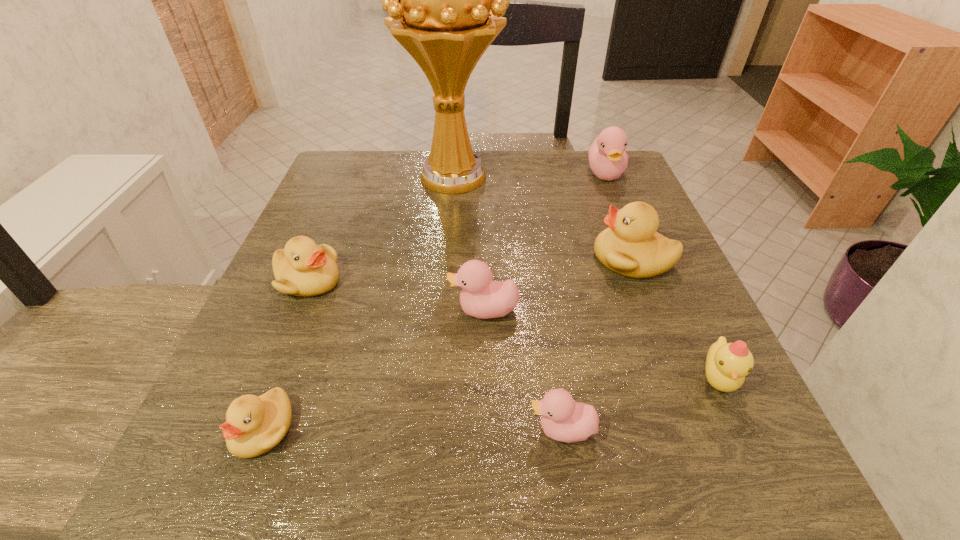
Locate an element on the screen. The width and height of the screenshot is (960, 540). free area in between the second nearest pink duckling and the tallest object is located at coordinates (468, 244).

I want to click on free space between the second nearest pink duckling and the biggest yellow duckling, so click(558, 285).

The width and height of the screenshot is (960, 540). What are the coordinates of `free spot between the smallest yellow duckling and the farthest duckling` in the screenshot? It's located at (434, 301).

Where is `free spot between the second farthest pink duckling and the gold trophy_cup`? free spot between the second farthest pink duckling and the gold trophy_cup is located at coordinates (468, 244).

Image resolution: width=960 pixels, height=540 pixels. I want to click on free space between the smallest yellow duckling and the nearest pink duckling, so click(x=412, y=429).

Identify which object is the third nearest to the nearest pink duckling. Please provide its 2D coordinates. Your answer should be formatted as a tuple, i.e. [(x, y)], where the tuple contains the x and y coordinates of a point satisfying the conditions above.

[(631, 247)]

This screenshot has height=540, width=960. What are the coordinates of `object that is the fifth closest to the smallest yellow duckling` in the screenshot? It's located at (631, 247).

Identify which duckling is located as the nearest to the tallest object. Please provide its 2D coordinates. Your answer should be formatted as a tuple, i.e. [(x, y)], where the tuple contains the x and y coordinates of a point satisfying the conditions above.

[(303, 268)]

Image resolution: width=960 pixels, height=540 pixels. In order to click on duckling that stands as the second closest to the trophy_cup in this screenshot , I will do `click(631, 247)`.

The image size is (960, 540). In order to click on pink duckling that is the third closest to the biggest yellow duckling in this screenshot , I will do `click(564, 420)`.